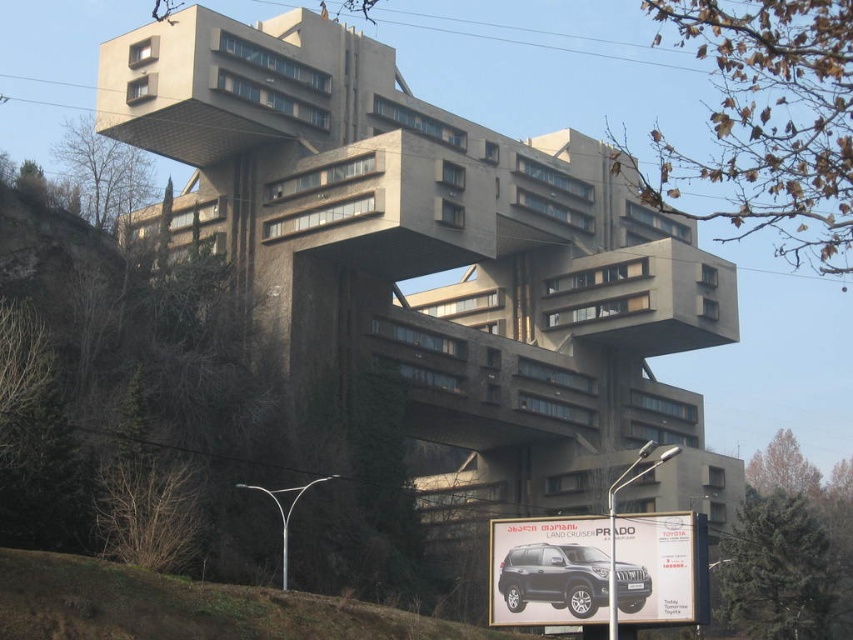
Question: Is gray concrete building at center to the right of brown grass at lower left from the viewer's perspective?

Choices:
 (A) no
 (B) yes

Answer: (A)

Question: Can you confirm if gray concrete building at center is positioned to the left of matte black suv at center?

Choices:
 (A) no
 (B) yes

Answer: (B)

Question: Which object appears closest to the camera in this image?

Choices:
 (A) brown grass at lower left
 (B) matte black suv at center
 (C) gray concrete building at center

Answer: (A)

Question: Can you confirm if brown grass at lower left is thinner than matte black suv at center?

Choices:
 (A) no
 (B) yes

Answer: (A)

Question: Among these objects, which one is farthest from the camera?

Choices:
 (A) gray concrete building at center
 (B) matte black suv at center
 (C) brown grass at lower left

Answer: (A)

Question: Estimate the real-world distances between objects in this image. Which object is farther from the matte black suv at center?

Choices:
 (A) gray concrete building at center
 (B) brown grass at lower left

Answer: (A)